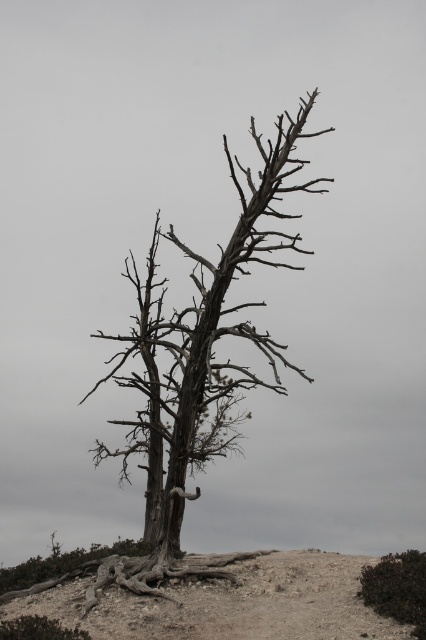
Question: Is the position of gray bark tree at center less distant than that of brown sandy soil at lower center?

Choices:
 (A) yes
 (B) no

Answer: (B)

Question: In this image, where is gray bark tree at center located relative to brown sandy soil at lower center?

Choices:
 (A) above
 (B) below

Answer: (A)

Question: Is gray bark tree at center further to the viewer compared to brown sandy soil at lower center?

Choices:
 (A) no
 (B) yes

Answer: (B)

Question: Which point is farther to the camera?

Choices:
 (A) (117, 556)
 (B) (221, 284)

Answer: (B)

Question: Among these objects, which one is farthest from the camera?

Choices:
 (A) brown sandy soil at lower center
 (B) gray bark tree at center

Answer: (B)

Question: Which point appears closest to the camera in this image?

Choices:
 (A) (161, 358)
 (B) (233, 621)

Answer: (B)